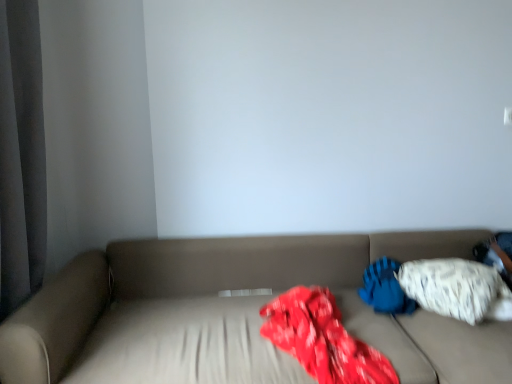
Question: Based on their sizes in the image, would you say beige fabric couch at center is bigger or smaller than white soft pillow at right, acting as the first pillow starting from the left?

Choices:
 (A) big
 (B) small

Answer: (A)

Question: Considering their positions, is beige fabric couch at center located in front of or behind white soft pillow at right, marked as the 2th pillow in a right-to-left arrangement?

Choices:
 (A) behind
 (B) front

Answer: (B)

Question: Considering the real-world distances, which object is farthest from the white textured pillow at right, placed as the second pillow when sorted from left to right?

Choices:
 (A) white soft pillow at right, acting as the first pillow starting from the left
 (B) beige fabric couch at center

Answer: (B)

Question: Considering the real-world distances, which object is farthest from the white soft pillow at right, acting as the first pillow starting from the left?

Choices:
 (A) beige fabric couch at center
 (B) white textured pillow at right, placed as the first pillow when sorted from right to left

Answer: (A)